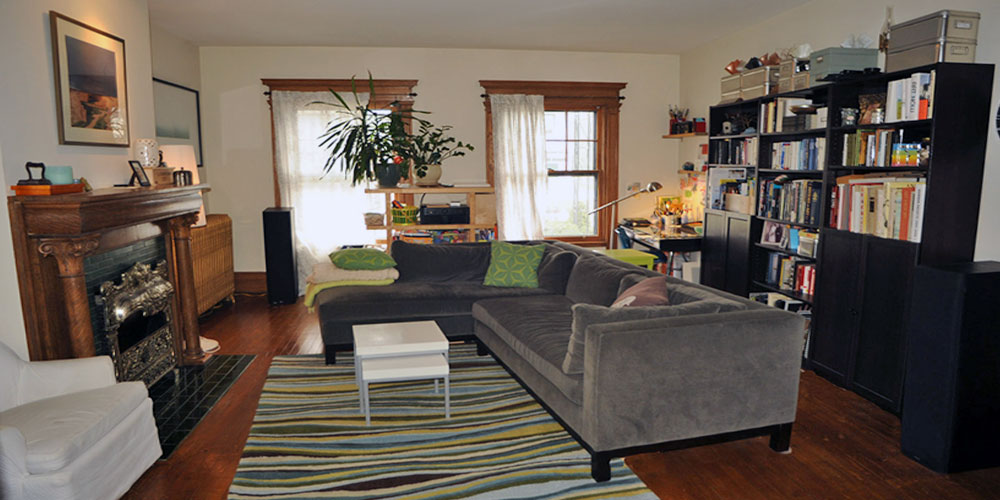
The height and width of the screenshot is (500, 1000). Identify the location of chair. (77, 422).